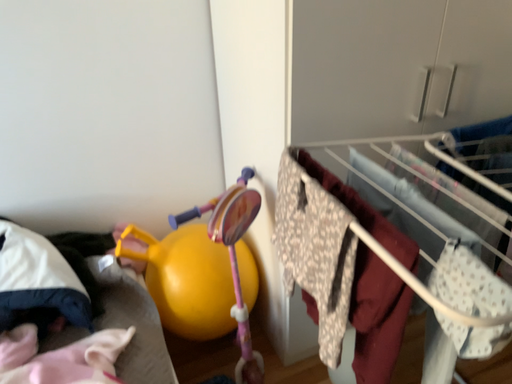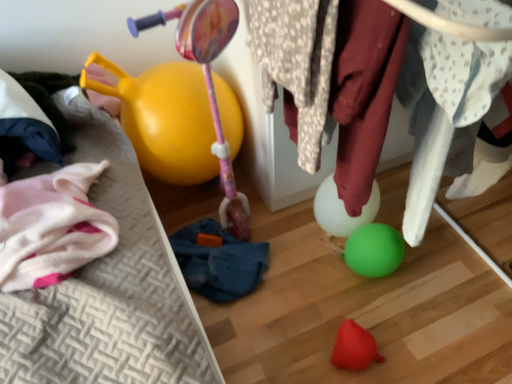
Question: How did the camera likely rotate when shooting the video?

Choices:
 (A) rotated downward
 (B) rotated upward

Answer: (A)